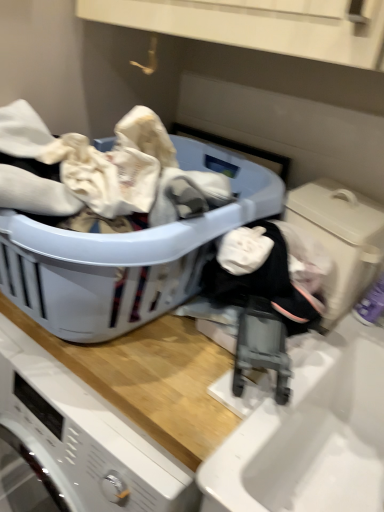
Question: From a real-world perspective, is beige plastic washing machine at lower right positioned over plastic laundry basket at center based on gravity?

Choices:
 (A) yes
 (B) no

Answer: (A)

Question: Does beige plastic washing machine at lower right lie in front of plastic laundry basket at center?

Choices:
 (A) no
 (B) yes

Answer: (A)

Question: Is beige plastic washing machine at lower right at the right side of plastic laundry basket at center?

Choices:
 (A) yes
 (B) no

Answer: (A)

Question: Is beige plastic washing machine at lower right further to the viewer compared to plastic laundry basket at center?

Choices:
 (A) yes
 (B) no

Answer: (A)

Question: Is beige plastic washing machine at lower right positioned with its back to plastic laundry basket at center?

Choices:
 (A) yes
 (B) no

Answer: (B)

Question: From the image's perspective, is beige plastic washing machine at lower right under plastic laundry basket at center?

Choices:
 (A) yes
 (B) no

Answer: (A)

Question: Does plastic laundry basket at center have a smaller size compared to beige plastic washing machine at lower right?

Choices:
 (A) no
 (B) yes

Answer: (A)

Question: Can you confirm if plastic laundry basket at center is taller than beige plastic washing machine at lower right?

Choices:
 (A) no
 (B) yes

Answer: (B)

Question: Is plastic laundry basket at center outside beige plastic washing machine at lower right?

Choices:
 (A) yes
 (B) no

Answer: (A)

Question: Is plastic laundry basket at center oriented towards beige plastic washing machine at lower right?

Choices:
 (A) no
 (B) yes

Answer: (A)

Question: From the image's perspective, is plastic laundry basket at center over beige plastic washing machine at lower right?

Choices:
 (A) no
 (B) yes

Answer: (B)

Question: Is plastic laundry basket at center surrounding beige plastic washing machine at lower right?

Choices:
 (A) yes
 (B) no

Answer: (B)

Question: Based on their positions, is plastic laundry basket at center located to the left or right of beige plastic washing machine at lower right?

Choices:
 (A) right
 (B) left

Answer: (B)